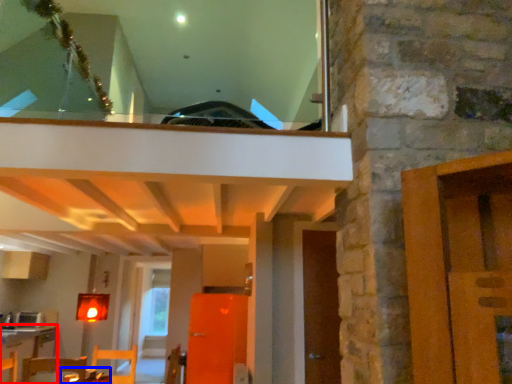
Question: Which point is further to the camera, table (highlighted by a red box) or table (highlighted by a blue box)?

Choices:
 (A) table
 (B) table

Answer: (A)